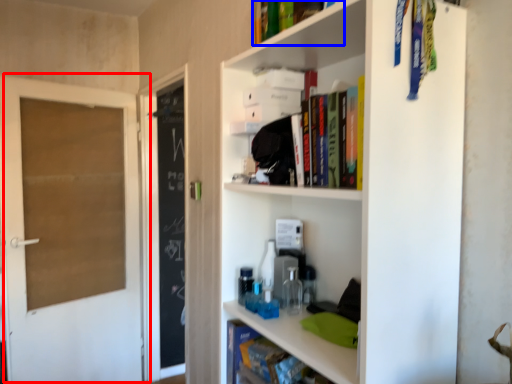
Question: Which point is further to the camera, door (highlighted by a red box) or book (highlighted by a blue box)?

Choices:
 (A) door
 (B) book

Answer: (A)